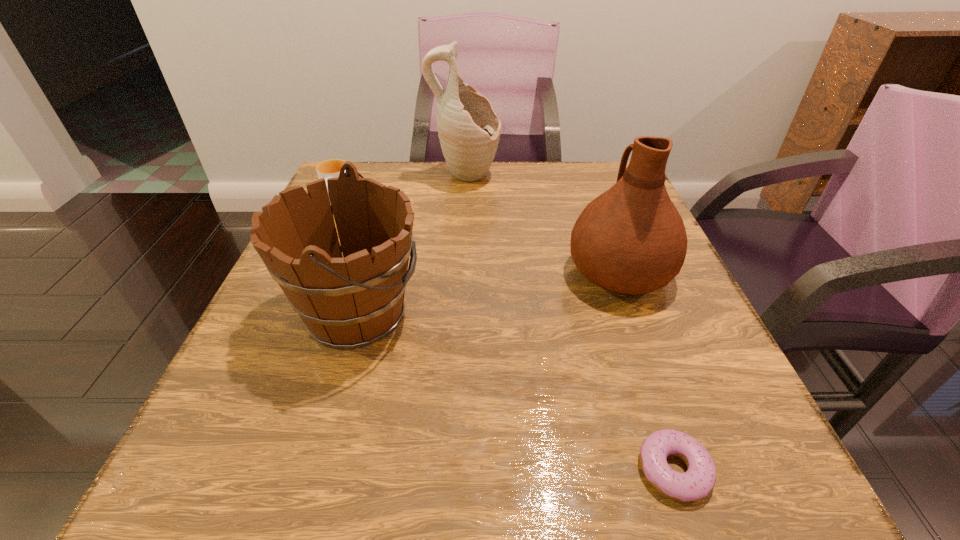
This screenshot has height=540, width=960. I want to click on cup that is at the left edge, so click(331, 168).

Find the location of `pitcher that is at the right edge`. pitcher that is at the right edge is located at coordinates 631,239.

Image resolution: width=960 pixels, height=540 pixels. Find the location of `doughnut situated at the right edge`. doughnut situated at the right edge is located at coordinates (698, 481).

Where is `object situated at the far left corner`? Image resolution: width=960 pixels, height=540 pixels. object situated at the far left corner is located at coordinates click(x=331, y=168).

The width and height of the screenshot is (960, 540). In order to click on object situated at the near right corner in this screenshot , I will do `click(698, 481)`.

Image resolution: width=960 pixels, height=540 pixels. Find the location of `vacant space at the far edge`. vacant space at the far edge is located at coordinates (424, 175).

Identify the location of vacant region at the near edge of the desktop. The image size is (960, 540). (476, 455).

The width and height of the screenshot is (960, 540). Find the location of `vacant space at the right edge of the desktop`. vacant space at the right edge of the desktop is located at coordinates (681, 330).

Where is `blank space at the near left corner of the desktop`? The image size is (960, 540). blank space at the near left corner of the desktop is located at coordinates (279, 482).

Find the location of a particular element. The image size is (960, 540). vacant area at the far right corner is located at coordinates (599, 163).